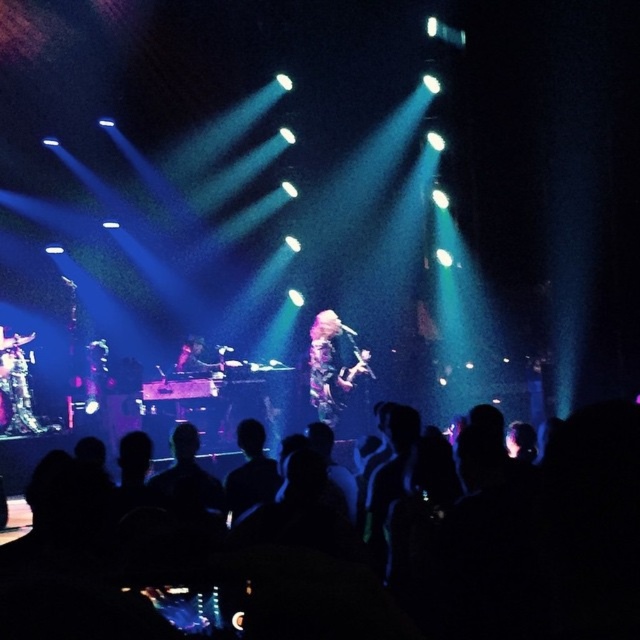
Question: Does black silhouettes at lower center appear on the left side of floral-patterned dress at center?

Choices:
 (A) yes
 (B) no

Answer: (A)

Question: Which object appears farthest from the camera in this image?

Choices:
 (A) floral-patterned dress at center
 (B) black silhouettes at lower center

Answer: (A)

Question: Which object is closer to the camera taking this photo?

Choices:
 (A) floral-patterned dress at center
 (B) black silhouettes at lower center

Answer: (B)

Question: Can you confirm if black silhouettes at lower center is smaller than floral-patterned dress at center?

Choices:
 (A) no
 (B) yes

Answer: (B)

Question: Does black silhouettes at lower center have a larger size compared to floral-patterned dress at center?

Choices:
 (A) no
 (B) yes

Answer: (A)

Question: Which object appears closest to the camera in this image?

Choices:
 (A) black silhouettes at lower center
 (B) floral-patterned dress at center

Answer: (A)